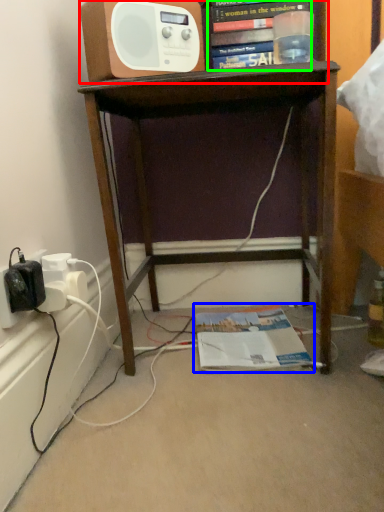
Question: Estimate the real-world distances between objects in this image. Which object is closer to shelf (highlighted by a red box), magazine (highlighted by a blue box) or book (highlighted by a green box)?

Choices:
 (A) magazine
 (B) book

Answer: (B)